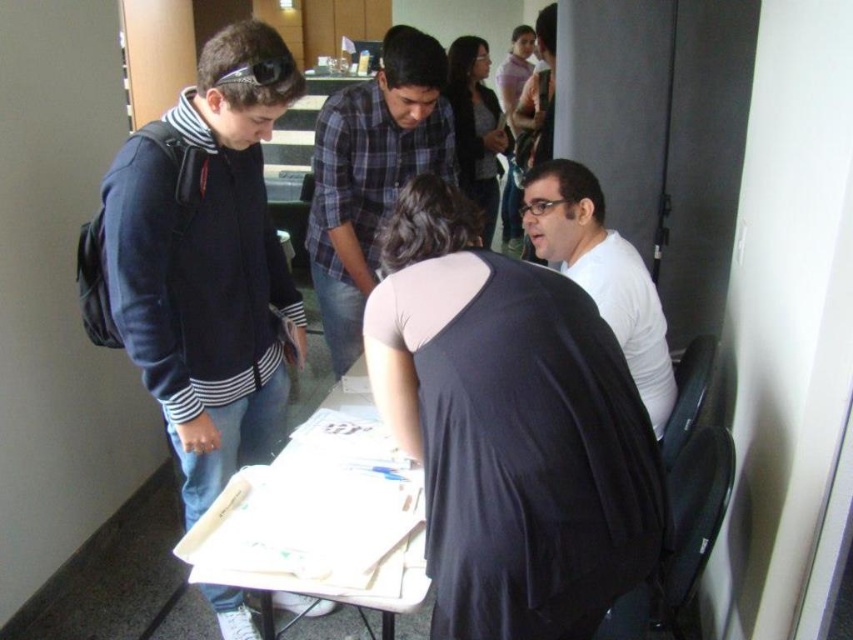
You are trying to place a decorative item on the table between the matte black shirt at center and the transparent plastic glasses at center. Which object should you move to make space?

The matte black shirt at center is wider than the transparent plastic glasses at center, so you should move the matte black shirt at center to make space.

Based on the coordinates provided, which object corresponds to the location marked by the point at (476, 125)?

The point at (476, 125) corresponds to the matte black shirt at center.

You are standing in the room and want to hand a document to the person wearing the matte black sunglasses at upper center. Which direction should you move to reach them first without passing through the matte black jacket at left?

The matte black jacket at left is to the left of the matte black sunglasses at upper center. To reach the matte black sunglasses at upper center first without passing through the matte black jacket at left, you should move to the right.